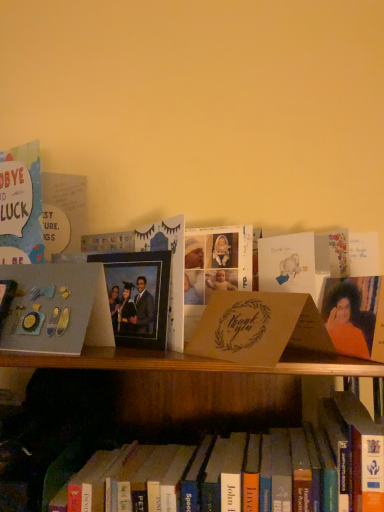
Describe the element at coordinates (21, 206) in the screenshot. I see `matte blue card at left, which is the 2th book in right-to-left order` at that location.

You are a GUI agent. You are given a task and a screenshot of the screen. Output one action in this format:
    pyautogui.click(x=<x>, y=<y>)
    Task: Click on the matte brown card at center, the 2th paperback book when ordered from right to left
    The width and height of the screenshot is (384, 512).
    Given the screenshot: What is the action you would take?
    click(258, 328)

What is the approximate width of orange fabric portrait at right?

orange fabric portrait at right is 3.91 centimeters in width.

Locate an element on the screen. matte gray paper at left, the 1th paperback book viewed from the left is located at coordinates (56, 309).

Is orange fabric portrait at right thinner than matte brown card at center, the third paperback book positioned from the left?

Incorrect, the width of orange fabric portrait at right is not less than that of matte brown card at center, the third paperback book positioned from the left.

From a real-world perspective, is orange fabric portrait at right under matte brown card at center, the third paperback book positioned from the left?

Yes, from a real-world perspective, orange fabric portrait at right is below matte brown card at center, the third paperback book positioned from the left.

Between orange fabric portrait at right and matte brown card at center, which appears as the first paperback book when viewed from the right, which one has more height?

With more height is orange fabric portrait at right.

Looking at this image, what's the angular difference between orange fabric portrait at right and matte brown card at center, the third paperback book positioned from the left,'s facing directions?

The angle between the facing direction of orange fabric portrait at right and the facing direction of matte brown card at center, the third paperback book positioned from the left, is 19.5 degrees.

Is point (341, 312) behind point (30, 149)?

No, it is not.

Looking at this image, does orange fabric portrait at right have a greater height compared to matte blue card at left, marked as the first book in a top-to-bottom arrangement?

No, orange fabric portrait at right is not taller than matte blue card at left, marked as the first book in a top-to-bottom arrangement.

Is orange fabric portrait at right wider or thinner than matte blue card at left, marked as the first book in a left-to-right arrangement?

Considering their sizes, orange fabric portrait at right looks broader than matte blue card at left, marked as the first book in a left-to-right arrangement.

From a real-world perspective, is orange fabric portrait at right under matte blue card at left, the second book in the bottom-to-top sequence?

Yes, from a real-world perspective, orange fabric portrait at right is beneath matte blue card at left, the second book in the bottom-to-top sequence.

Could you tell me if matte brown card at center, placed as the 2th paperback book when sorted from left to right, is turned towards matte blue card at left, which is the 2th book in right-to-left order?

No, matte brown card at center, placed as the 2th paperback book when sorted from left to right, is not facing towards matte blue card at left, which is the 2th book in right-to-left order.

Is matte brown card at center, placed as the 2th paperback book when sorted from left to right, positioned beyond the bounds of matte blue card at left, marked as the first book in a top-to-bottom arrangement?

Yes, matte brown card at center, placed as the 2th paperback book when sorted from left to right, is outside of matte blue card at left, marked as the first book in a top-to-bottom arrangement.

There is a matte blue card at left, marked as the first book in a top-to-bottom arrangement. Where is `the 3rd paperback book below it (from a real-world perspective)`? the 3rd paperback book below it (from a real-world perspective) is located at coordinates coord(258,328).

Is point (207, 347) less distant than point (344, 453)?

No, (207, 347) is behind (344, 453).

Is matte brown card at center, placed as the 2th paperback book when sorted from left to right, turned away from hardcover book at center, the second book in the left-to-right sequence?

No, matte brown card at center, placed as the 2th paperback book when sorted from left to right,'s orientation is not away from hardcover book at center, the second book in the left-to-right sequence.

Considering the relative sizes of matte brown card at center, the 2th paperback book when ordered from right to left, and hardcover book at center, the second book in the left-to-right sequence, in the image provided, is matte brown card at center, the 2th paperback book when ordered from right to left, shorter than hardcover book at center, the second book in the left-to-right sequence,?

Correct, matte brown card at center, the 2th paperback book when ordered from right to left, is not as tall as hardcover book at center, the second book in the left-to-right sequence.

Is matte brown card at center, the 2th paperback book when ordered from right to left, bigger than hardcover book at center, the second book in the left-to-right sequence?

Actually, matte brown card at center, the 2th paperback book when ordered from right to left, might be smaller than hardcover book at center, the second book in the left-to-right sequence.

Which object is further away from the camera taking this photo, matte brown card at center, which appears as the first paperback book when viewed from the right, or matte blue card at left, which is the 2th book in right-to-left order?

matte blue card at left, which is the 2th book in right-to-left order, is further away from the camera.

Is matte brown card at center, the third paperback book positioned from the left, smaller than matte blue card at left, marked as the first book in a top-to-bottom arrangement?

Correct, matte brown card at center, the third paperback book positioned from the left, occupies less space than matte blue card at left, marked as the first book in a top-to-bottom arrangement.

Considering the sizes of matte brown card at center, the third paperback book positioned from the left, and matte blue card at left, which is the 2th book in right-to-left order, in the image, is matte brown card at center, the third paperback book positioned from the left, wider or thinner than matte blue card at left, which is the 2th book in right-to-left order,?

Considering their sizes, matte brown card at center, the third paperback book positioned from the left, looks slimmer than matte blue card at left, which is the 2th book in right-to-left order.

Is matte brown card at center, which appears as the first paperback book when viewed from the right, not close to matte blue card at left, marked as the first book in a left-to-right arrangement?

matte brown card at center, which appears as the first paperback book when viewed from the right, is actually quite close to matte blue card at left, marked as the first book in a left-to-right arrangement.

How distant is matte blue card at left, which is the 2th book in right-to-left order, from matte brown card at center, the 2th paperback book when ordered from right to left?

matte blue card at left, which is the 2th book in right-to-left order, is 13.74 inches from matte brown card at center, the 2th paperback book when ordered from right to left.

Is matte blue card at left, which is the 2th book in right-to-left order, facing away from matte brown card at center, the 2th paperback book when ordered from right to left?

No, matte brown card at center, the 2th paperback book when ordered from right to left, is not at the back of matte blue card at left, which is the 2th book in right-to-left order.

Which is correct: matte blue card at left, which is the 2th book in right-to-left order, is inside matte brown card at center, the 2th paperback book when ordered from right to left, or outside of it?

matte blue card at left, which is the 2th book in right-to-left order, is not enclosed by matte brown card at center, the 2th paperback book when ordered from right to left.

How many degrees apart are the facing directions of matte blue card at left, which is the 2th book in right-to-left order, and matte brown card at center, the 2th paperback book when ordered from right to left?

matte blue card at left, which is the 2th book in right-to-left order, and matte brown card at center, the 2th paperback book when ordered from right to left, are facing 15 degrees away from each other.

From the image's perspective, is hardcover book at center, the first book viewed from the right, over matte brown card at center, which appears as the first paperback book when viewed from the right?

No, from the image's perspective, hardcover book at center, the first book viewed from the right, is not on top of matte brown card at center, which appears as the first paperback book when viewed from the right.

Identify the location of the 2nd paperback book to the right of the hardcover book at center, which is counted as the first book, starting from the bottom, counting from the anchor's position. (287, 264).

Can you see hardcover book at center, arranged as the 2th book when viewed from the top, touching matte brown card at center, which appears as the first paperback book when viewed from the right?

No, hardcover book at center, arranged as the 2th book when viewed from the top, is not with matte brown card at center, which appears as the first paperback book when viewed from the right.

You are a GUI agent. You are given a task and a screenshot of the screen. Output one action in this format:
    pyautogui.click(x=<x>, y=<y>)
    Task: Click on the 3rd paperback book behind the orange fabric portrait at right, counting from the anchor's position
    
    Given the screenshot: What is the action you would take?
    pyautogui.click(x=287, y=264)

The width and height of the screenshot is (384, 512). Identify the location of person in front of the matte blue card at left, marked as the first book in a top-to-bottom arrangement. (349, 321).

From the image, which object appears to be nearer to matte gray paper at left, the 3th paperback book from the right, matte brown card at center, which appears as the first paperback book when viewed from the right, or hardcover book at center, arranged as the 2th book when viewed from the top?

Among the two, hardcover book at center, arranged as the 2th book when viewed from the top, is located nearer to matte gray paper at left, the 3th paperback book from the right.

Considering their positions, is matte black photo frame at center positioned further to hardcover book at center, the first book viewed from the right, than matte gray paper at left, the 3th paperback book from the right?

matte gray paper at left, the 3th paperback book from the right, is further to hardcover book at center, the first book viewed from the right.

Looking at the image, which one is located closer to matte black photo frame at center, orange fabric portrait at right or matte gray paper at left, the 3th paperback book from the right?

The object closer to matte black photo frame at center is matte gray paper at left, the 3th paperback book from the right.

From the image, which object appears to be farther from matte brown card at center, which appears as the first paperback book when viewed from the right, matte brown card at center, placed as the 2th paperback book when sorted from left to right, or hardcover book at center, the first book viewed from the right?

hardcover book at center, the first book viewed from the right, is further to matte brown card at center, which appears as the first paperback book when viewed from the right.

Based on their spatial positions, is matte blue card at left, the second book in the bottom-to-top sequence, or orange fabric portrait at right closer to matte brown card at center, placed as the 2th paperback book when sorted from left to right?

Based on the image, orange fabric portrait at right appears to be nearer to matte brown card at center, placed as the 2th paperback book when sorted from left to right.

Estimate the real-world distances between objects in this image. Which object is closer to matte brown card at center, the third paperback book positioned from the left, matte black photo frame at center or orange fabric portrait at right?

Based on the image, orange fabric portrait at right appears to be nearer to matte brown card at center, the third paperback book positioned from the left.

When comparing their distances from matte brown card at center, the third paperback book positioned from the left, does matte brown card at center, the 2th paperback book when ordered from right to left, or matte black photo frame at center seem closer?

Among the two, matte brown card at center, the 2th paperback book when ordered from right to left, is located nearer to matte brown card at center, the third paperback book positioned from the left.

Which object lies nearer to the anchor point matte brown card at center, the 2th paperback book when ordered from right to left, matte blue card at left, the second book in the bottom-to-top sequence, or matte gray paper at left, the 3th paperback book from the right?

matte gray paper at left, the 3th paperback book from the right.

The height and width of the screenshot is (512, 384). In order to click on paperback book between matte blue card at left, marked as the first book in a left-to-right arrangement, and matte brown card at center, the 2th paperback book when ordered from right to left in this screenshot , I will do `click(56, 309)`.

What are the coordinates of `book between matte gray paper at left, the 1th paperback book viewed from the left, and matte brown card at center, the third paperback book positioned from the left` in the screenshot? It's located at (243, 470).

You are a GUI agent. You are given a task and a screenshot of the screen. Output one action in this format:
    pyautogui.click(x=<x>, y=<y>)
    Task: Click on the picture frame situated between matte blue card at left, marked as the first book in a top-to-bottom arrangement, and orange fabric portrait at right from left to right
    The image size is (384, 512).
    Given the screenshot: What is the action you would take?
    pyautogui.click(x=137, y=296)

Locate an element on the screen. Image resolution: width=384 pixels, height=512 pixels. book situated between matte blue card at left, the second book in the bottom-to-top sequence, and orange fabric portrait at right from left to right is located at coordinates (243, 470).